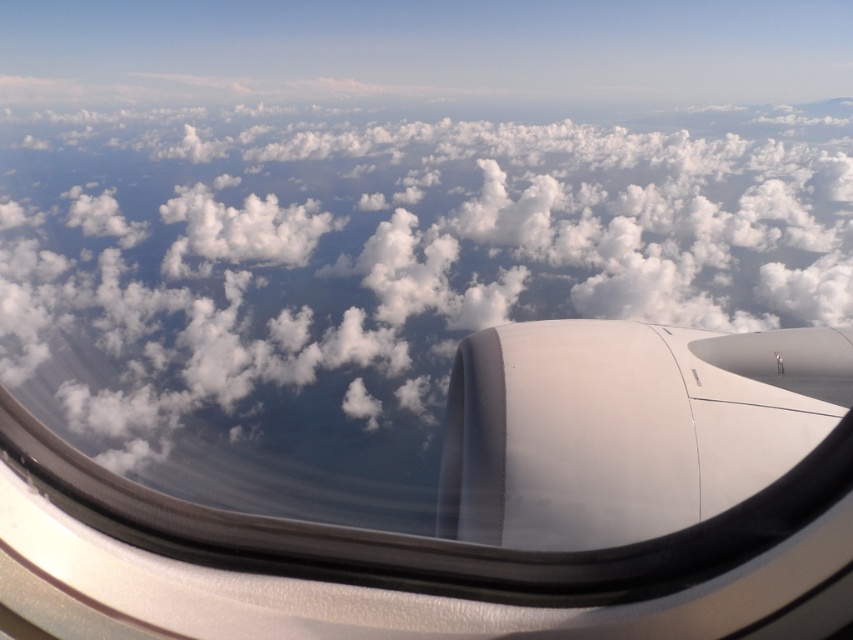
Question: Does white fluffy cloud at center appear on the right side of white matte engine at lower right?

Choices:
 (A) yes
 (B) no

Answer: (A)

Question: Does white fluffy cloud at center have a larger size compared to white matte engine at lower right?

Choices:
 (A) no
 (B) yes

Answer: (B)

Question: Can you confirm if white fluffy cloud at center is wider than white matte engine at lower right?

Choices:
 (A) no
 (B) yes

Answer: (B)

Question: Which of the following is the closest to the observer?

Choices:
 (A) (460, 426)
 (B) (408, 355)

Answer: (A)

Question: Which point is closer to the camera?

Choices:
 (A) (595, 323)
 (B) (627, 288)

Answer: (A)